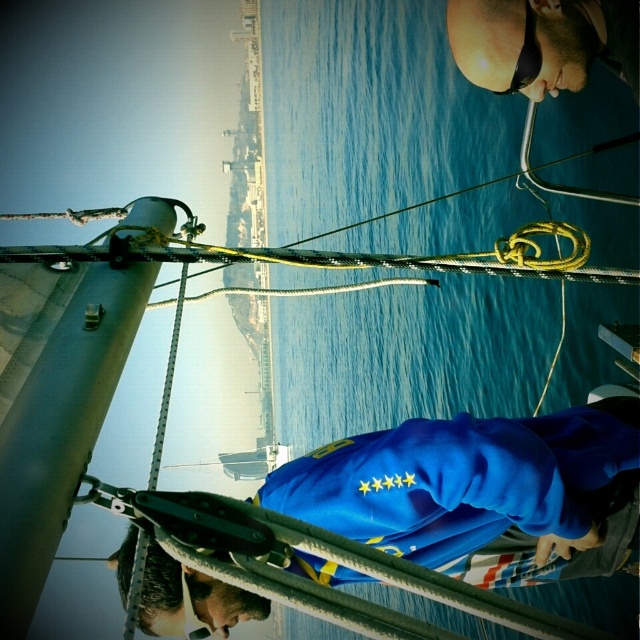
How much distance is there between blue fabric at center and sunglasses at upper center?

The distance of blue fabric at center from sunglasses at upper center is 1.99 meters.

The width and height of the screenshot is (640, 640). What do you see at coordinates (477, 490) in the screenshot?
I see `blue fabric at center` at bounding box center [477, 490].

Which is behind, point (396, 467) or point (470, 3)?

The point (470, 3) is behind.

Image resolution: width=640 pixels, height=640 pixels. Find the location of `blue fabric at center`. blue fabric at center is located at coordinates (477, 490).